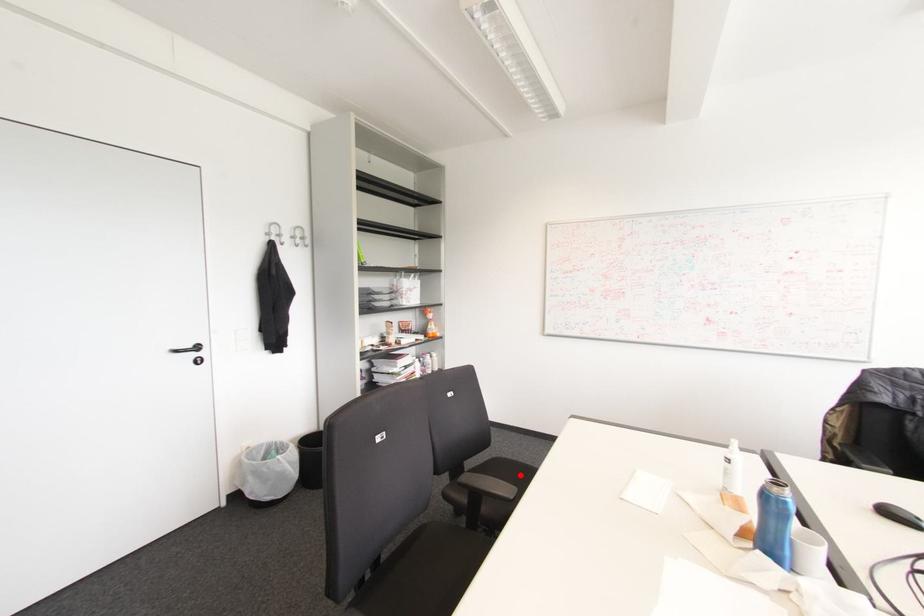
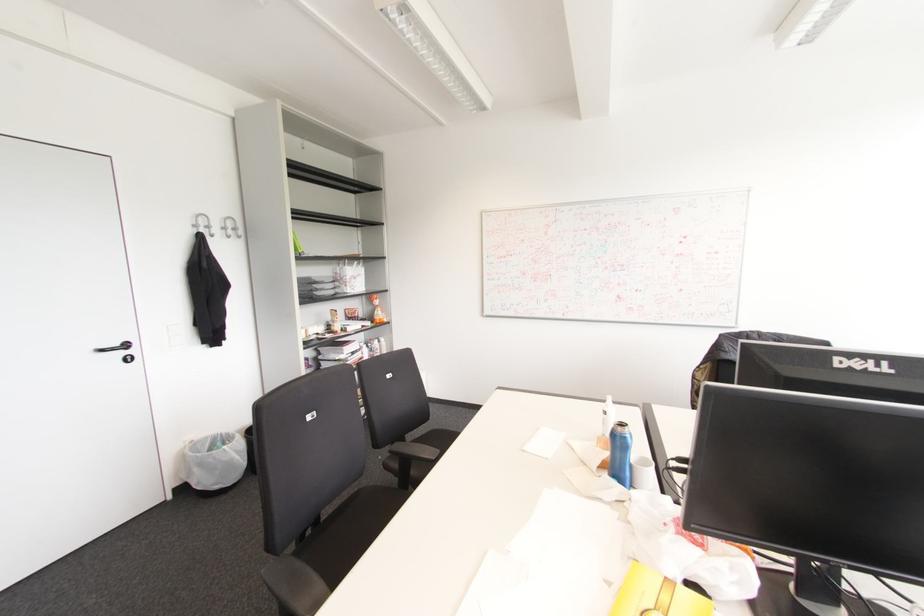
Question: I am providing you with two images of the same scene from different viewpoints. Image1 has a red point marked. In image2, the corresponding 3D location appears at what relative position? Reply with the corresponding letter.

Choices:
 (A) Closer
 (B) Farther

Answer: (A)